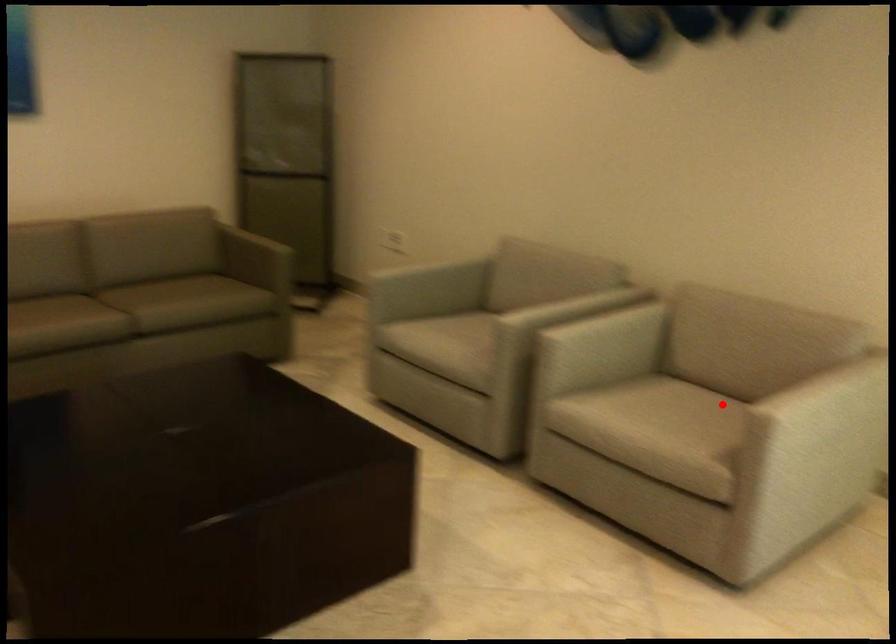
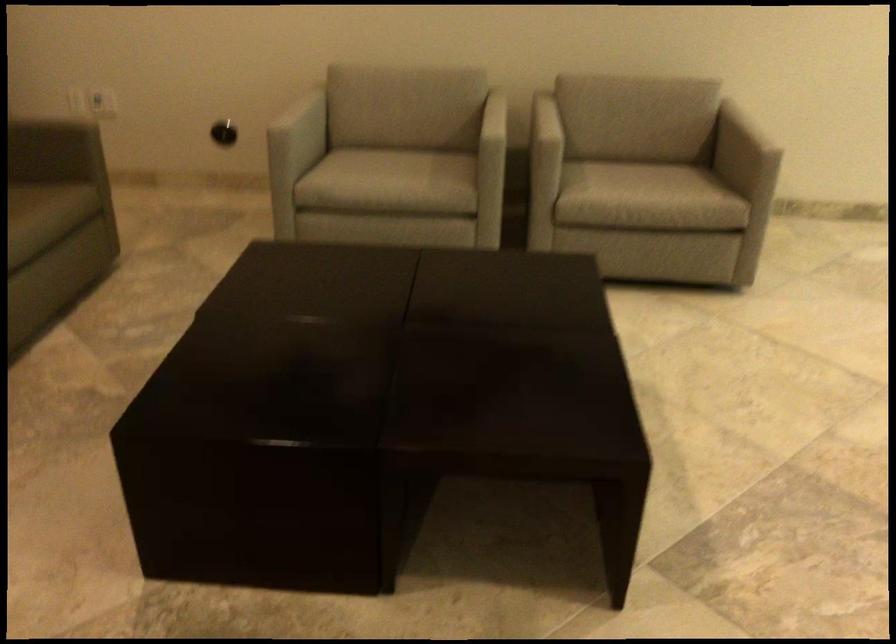
In the second image, find the point that corresponds to the highlighted location in the first image.

(633, 160)